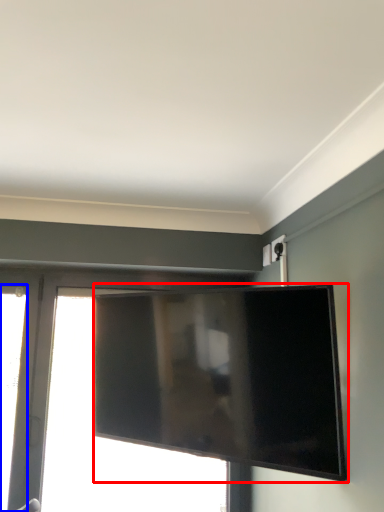
Question: Among these objects, which one is nearest to the camera, television (highlighted by a red box) or window (highlighted by a blue box)?

Choices:
 (A) television
 (B) window

Answer: (A)